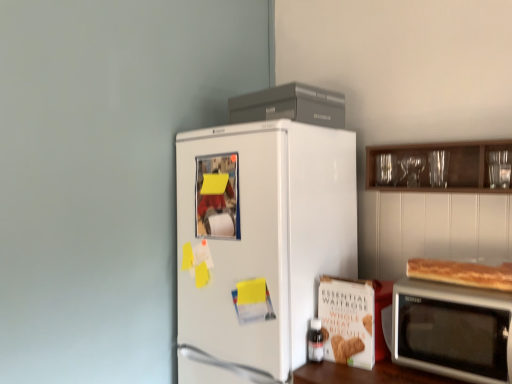
Question: Should I look upward or downward to see golden brown crusty bread at right?

Choices:
 (A) down
 (B) up

Answer: (A)

Question: Can you confirm if white matte refrigerator at center is shorter than golden brown crusty bread at right?

Choices:
 (A) no
 (B) yes

Answer: (A)

Question: Does white matte refrigerator at center have a greater height compared to golden brown crusty bread at right?

Choices:
 (A) yes
 (B) no

Answer: (A)

Question: Is white matte refrigerator at center thinner than golden brown crusty bread at right?

Choices:
 (A) yes
 (B) no

Answer: (B)

Question: Are white matte refrigerator at center and golden brown crusty bread at right making contact?

Choices:
 (A) yes
 (B) no

Answer: (B)

Question: Does white matte refrigerator at center lie in front of golden brown crusty bread at right?

Choices:
 (A) yes
 (B) no

Answer: (B)

Question: Is white matte refrigerator at center not within golden brown crusty bread at right?

Choices:
 (A) no
 (B) yes

Answer: (B)

Question: Is matte glass bottle at lower center at the right side of transparent glassware at upper right?

Choices:
 (A) yes
 (B) no

Answer: (B)

Question: Does matte glass bottle at lower center have a greater width compared to transparent glassware at upper right?

Choices:
 (A) no
 (B) yes

Answer: (A)

Question: Can transparent glassware at upper right be found inside matte glass bottle at lower center?

Choices:
 (A) no
 (B) yes

Answer: (A)

Question: Is the position of matte glass bottle at lower center less distant than that of transparent glassware at upper right?

Choices:
 (A) yes
 (B) no

Answer: (B)

Question: Considering the relative sizes of matte glass bottle at lower center and transparent glassware at upper right in the image provided, is matte glass bottle at lower center thinner than transparent glassware at upper right?

Choices:
 (A) no
 (B) yes

Answer: (B)

Question: Is matte glass bottle at lower center with transparent glassware at upper right?

Choices:
 (A) no
 (B) yes

Answer: (A)

Question: Does matte glass bottle at lower center lie behind white matte refrigerator at center?

Choices:
 (A) yes
 (B) no

Answer: (A)